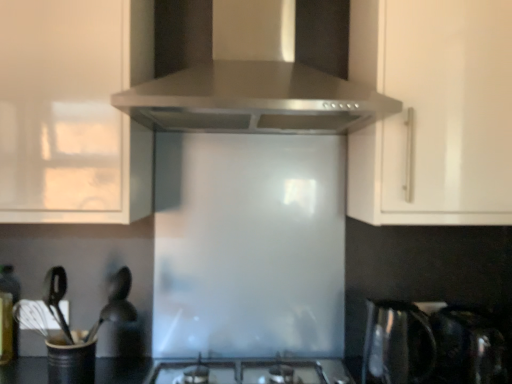
Question: Does point (411, 302) appear closer or farther from the camera than point (78, 360)?

Choices:
 (A) farther
 (B) closer

Answer: (A)

Question: Is satin metallic kettle at lower right inside the boundaries of black matte utensil holder at lower left, the 2th appliance viewed from the right, or outside?

Choices:
 (A) inside
 (B) outside

Answer: (B)

Question: Estimate the real-world distances between objects in this image. Which object is farther from the satin black kettle at lower right, arranged as the first appliance when viewed from the right?

Choices:
 (A) white glossy cabinet at upper left, which appears as the first cabinetry when viewed from the left
 (B) translucent glass bottle at lower left
 (C) white glossy cabinet handle at upper right, which is the 1th cabinetry from right to left
 (D) satin silver range hood at upper center
 (E) satin metallic kettle at lower right

Answer: (B)

Question: Considering the real-world distances, which object is farthest from the black matte utensil holder at lower left, which is the 1th appliance in left-to-right order?

Choices:
 (A) satin metallic kettle at lower right
 (B) white glossy cabinet handle at upper right, the second cabinetry viewed from the left
 (C) white glossy cabinet at upper left, which appears as the first cabinetry when viewed from the left
 (D) translucent glass bottle at lower left
 (E) satin silver range hood at upper center

Answer: (B)